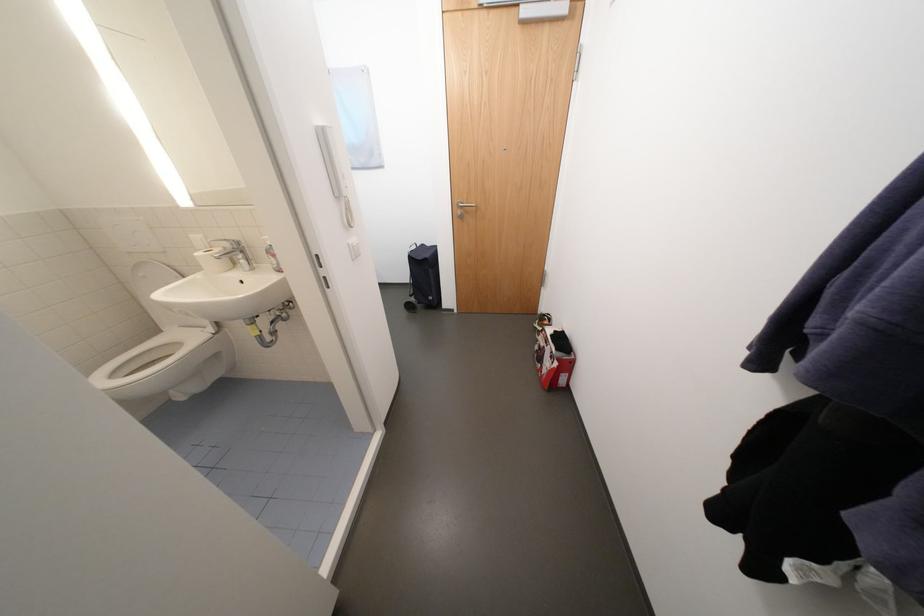
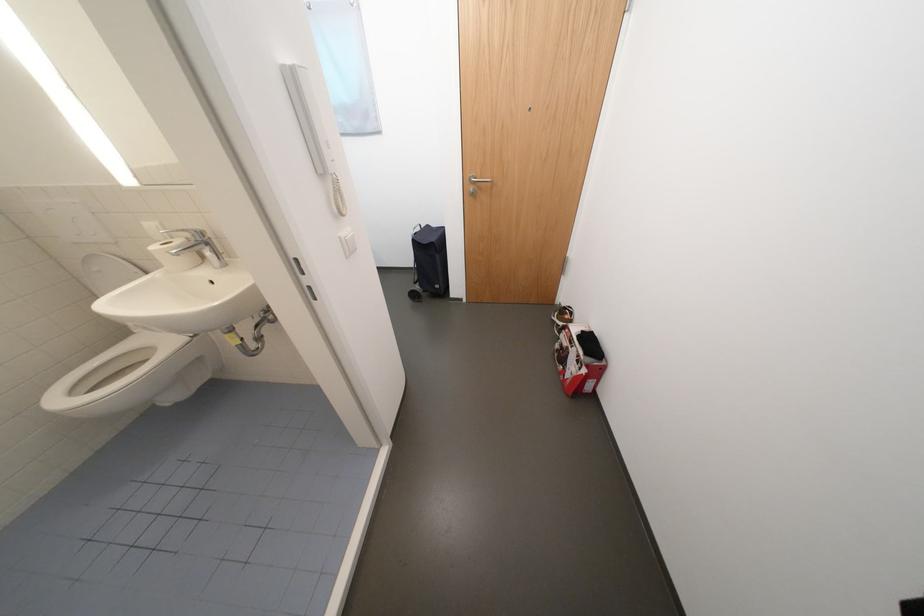
Question: How did the camera likely rotate?

Choices:
 (A) Left
 (B) Right
 (C) Up
 (D) Down

Answer: (D)